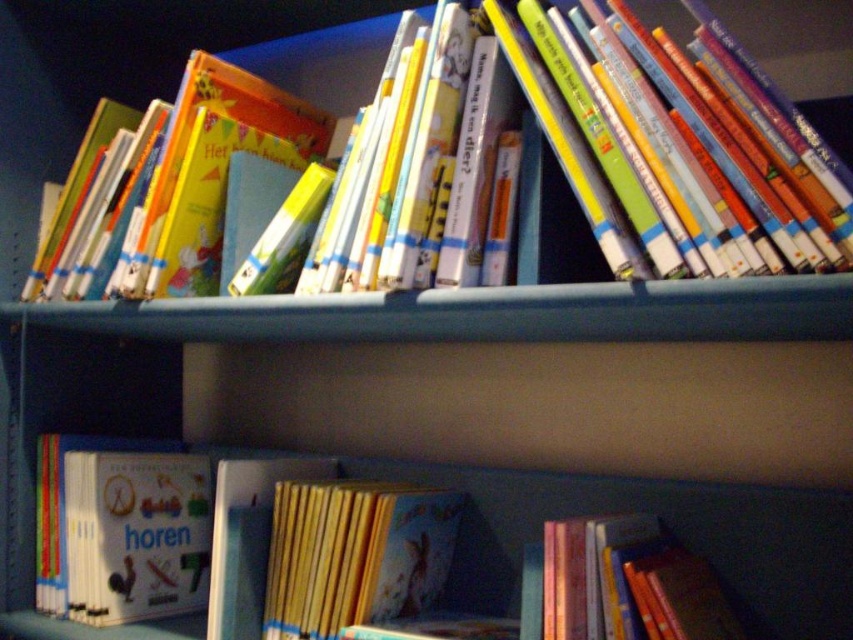
Question: Which object is farther from the camera taking this photo?

Choices:
 (A) yellow paper at center
 (B) hardcover books at upper center

Answer: (A)

Question: Based on their relative distances, which object is farther from the hardcover books at upper center?

Choices:
 (A) shiny pink book at lower right
 (B) yellow paper at center

Answer: (B)

Question: Considering the relative positions of matte white book at left and yellow paper at center in the image provided, where is matte white book at left located with respect to yellow paper at center?

Choices:
 (A) below
 (B) above

Answer: (A)

Question: Can you confirm if hardcover books at upper center is positioned to the left of matte white book at left?

Choices:
 (A) yes
 (B) no

Answer: (B)

Question: Estimate the real-world distances between objects in this image. Which object is closer to the hardcover books at upper center?

Choices:
 (A) hardcover book at upper center
 (B) matte white book at left
 (C) yellow paper at center

Answer: (C)

Question: In this image, where is matte white book at left located relative to yellow paper at center?

Choices:
 (A) left
 (B) right

Answer: (A)